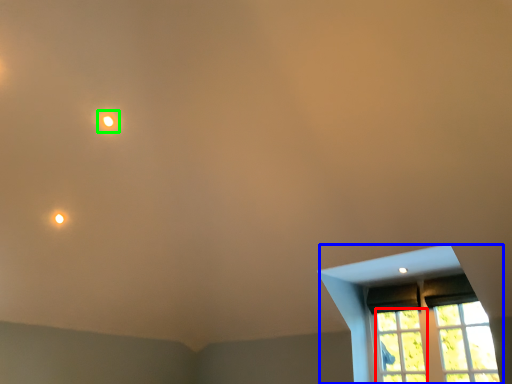
Question: Which object is the closest to the glass window (highlighted by a red box)? Choose among these: window (highlighted by a blue box) or light (highlighted by a green box).

Choices:
 (A) window
 (B) light

Answer: (A)